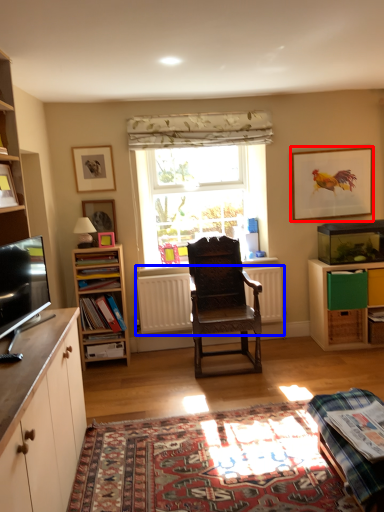
Question: Which point is closer to the camera, picture frame (highlighted by a red box) or radiator (highlighted by a blue box)?

Choices:
 (A) picture frame
 (B) radiator

Answer: (B)